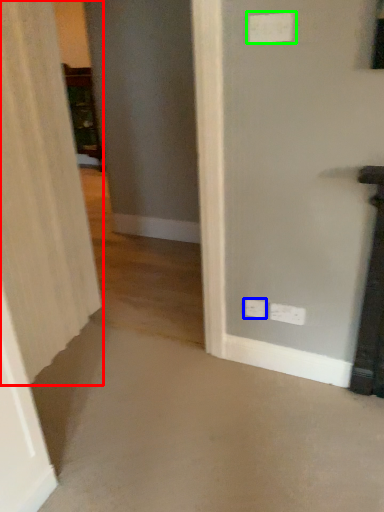
Question: Which is farther away from curtain (highlighted by a red box)? electric outlet (highlighted by a blue box) or electric outlet (highlighted by a green box)?

Choices:
 (A) electric outlet
 (B) electric outlet

Answer: (B)